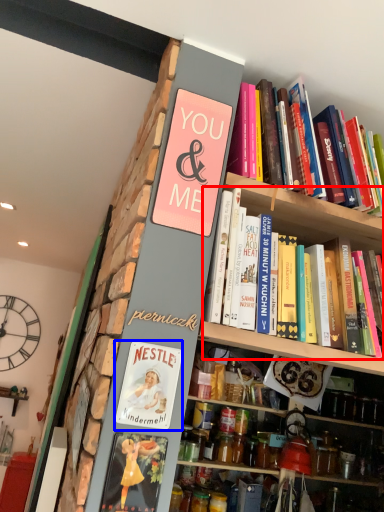
Question: Which of the following is the farthest to the observer, book (highlighted by a red box) or book cover (highlighted by a blue box)?

Choices:
 (A) book
 (B) book cover

Answer: (B)